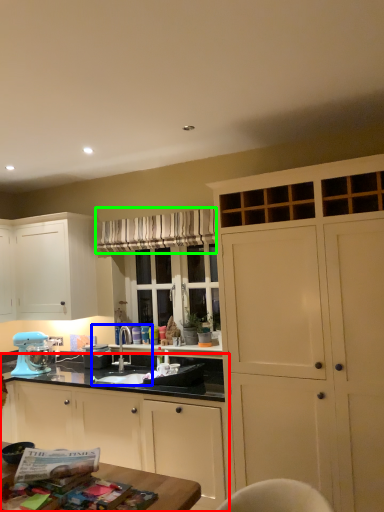
Question: Which object is positioned closest to cabinetry (highlighted by a red box)? Select from sink (highlighted by a blue box) and curtain (highlighted by a green box).

Choices:
 (A) sink
 (B) curtain

Answer: (A)